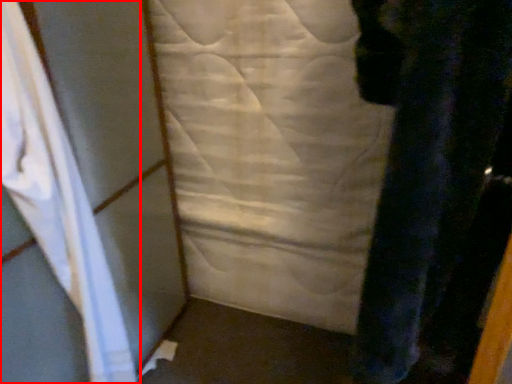
Question: From the image's perspective, what is the correct spatial positioning of curtain (annotated by the red box) in reference to sheet?

Choices:
 (A) below
 (B) above

Answer: (A)